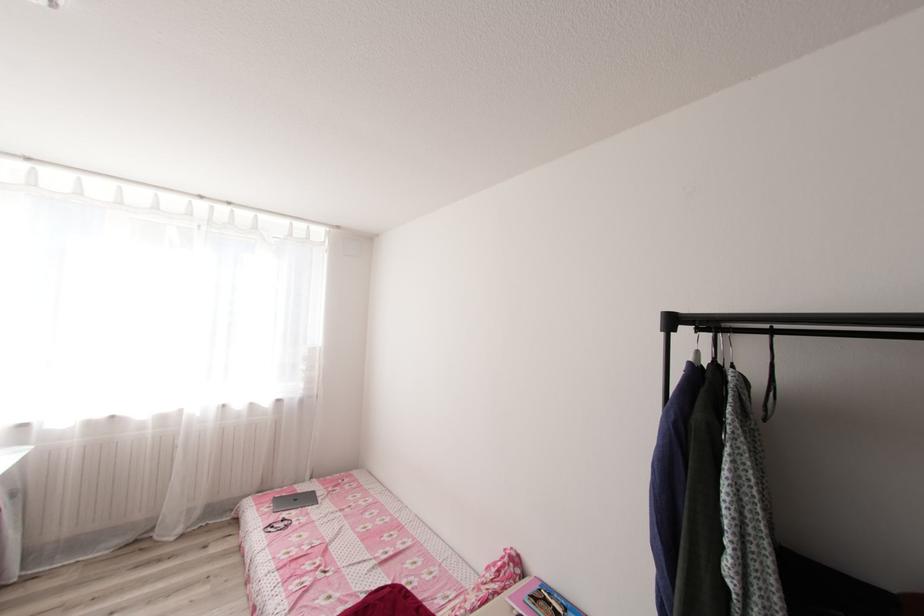
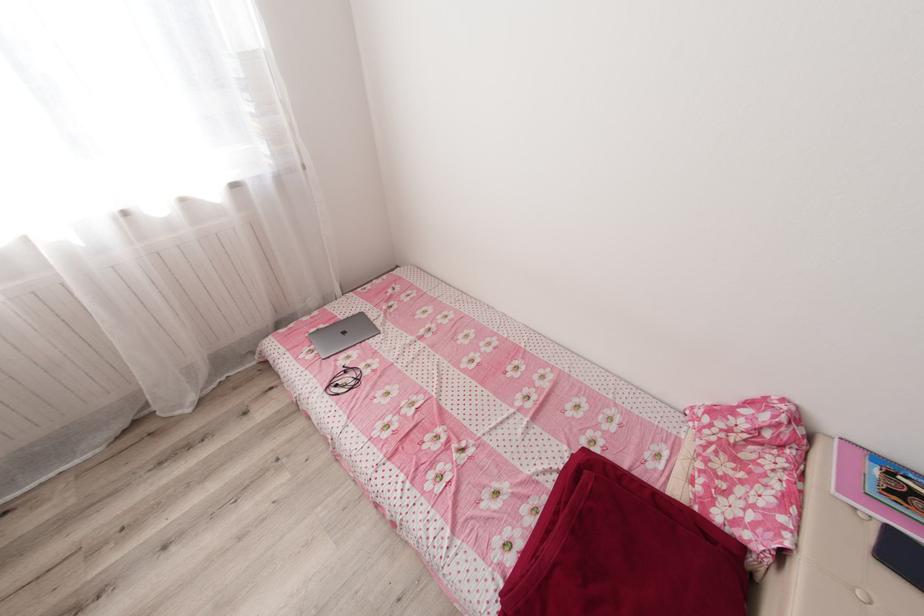
Locate, in the second image, the point that corresponds to point (286, 525) in the first image.

(353, 379)